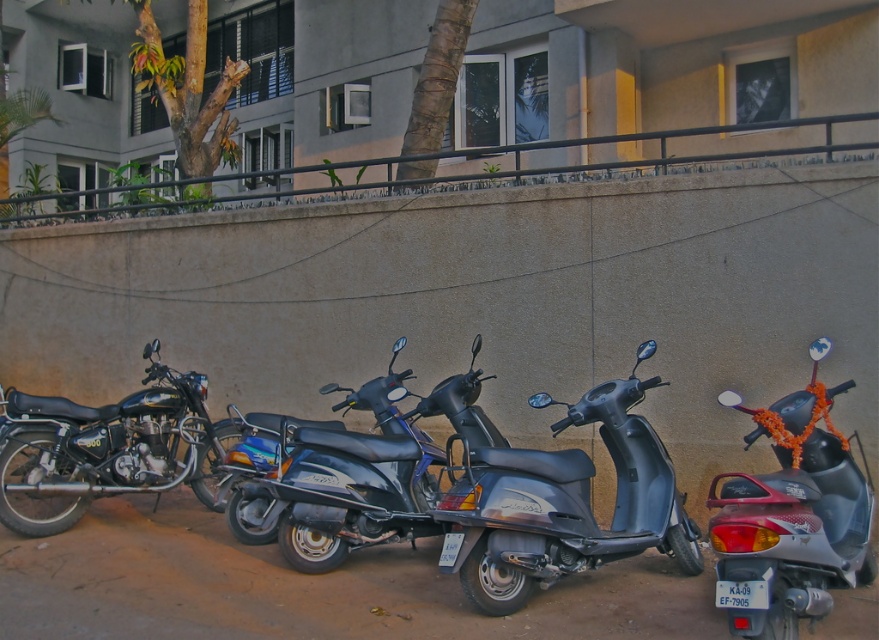
You are a delivery person who needs to choose between the metallic gray scooter at center and the silver metallic scooter at right to pick up a package. The package requires a scooter that can carry heavy items. Which scooter should you choose based on their height?

The metallic gray scooter at center is much taller than the silver metallic scooter at right. Since taller scooters often have larger frames which can better support heavier loads, you should choose the metallic gray scooter at center.

You are a delivery person who needs to park your scooter between the metallic gray scooter at center and the shiny black motorcycle at left. Based on their current positions, where should you place your scooter?

The metallic gray scooter at center is positioned on the right side of the shiny black motorcycle at left, so you should park your scooter between them by placing it to the right of the shiny black motorcycle at left and to the left of the metallic gray scooter at center.